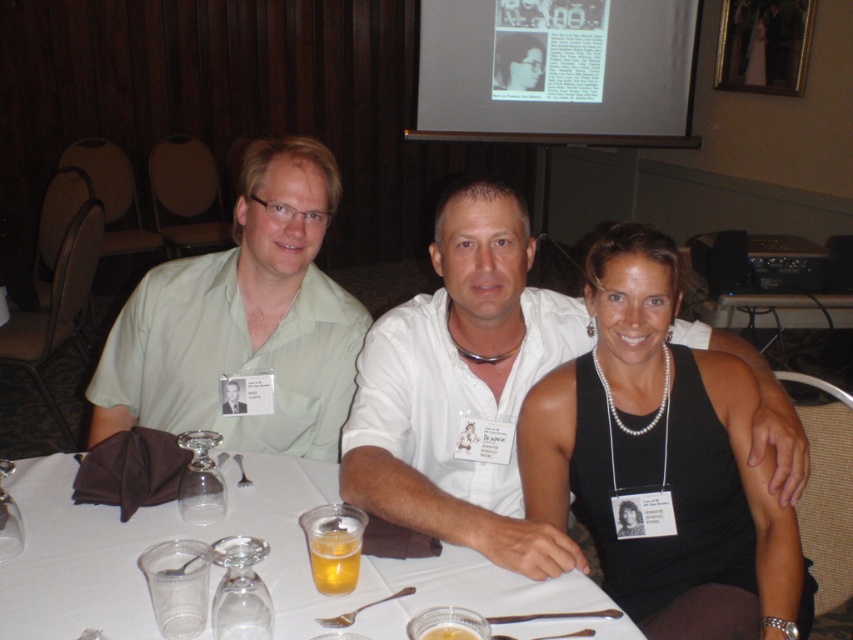
You are a photographer setting up for a group photo. You need to ensure there is enough space between the black satin tank top at center and the white paper table at center to avoid any overlapping in the photo. According to the scene description, what is the minimum distance you should maintain between them?

The black satin tank top at center is 16.40 inches away from the white paper table at center, so the minimum distance to maintain is 16.40 inches to prevent overlapping.

You are sitting at the table and want to hand a document to the person wearing the green matte shirt at left. Since you are seated at the white paper table at center, which direction should you pass the document to reach them?

You should pass the document to your left because the green matte shirt at left is located to the left of the white paper table at center where you are seated.

You are a photographer at a formal event and need to position a small decoration between the black satin tank top at center and the white paper table at center. Based on their widths, which object should the decoration be placed closer to?

The decoration should be placed closer to the black satin tank top at center because it is thinner than the white paper table at center.